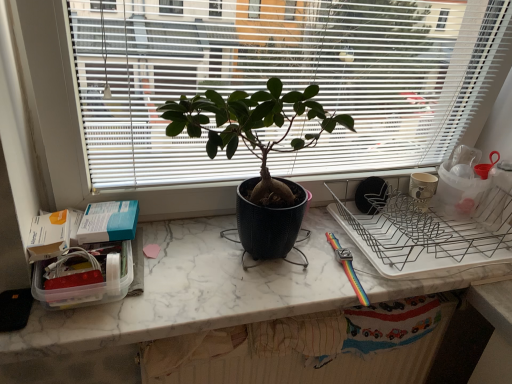
Question: Is matte black plant at center outside matte black pot at center?

Choices:
 (A) yes
 (B) no

Answer: (A)

Question: From a real-world perspective, does matte black plant at center sit lower than matte black pot at center?

Choices:
 (A) no
 (B) yes

Answer: (A)

Question: Can you see matte black plant at center touching matte black pot at center?

Choices:
 (A) no
 (B) yes

Answer: (A)

Question: Can you confirm if matte black plant at center is thinner than matte black pot at center?

Choices:
 (A) no
 (B) yes

Answer: (A)

Question: Can you confirm if matte black plant at center is shorter than matte black pot at center?

Choices:
 (A) no
 (B) yes

Answer: (A)

Question: Considering the positions of matte black pot at center and white marble countertop at center in the image, is matte black pot at center bigger or smaller than white marble countertop at center?

Choices:
 (A) big
 (B) small

Answer: (A)

Question: Do you think matte black pot at center is within white marble countertop at center, or outside of it?

Choices:
 (A) outside
 (B) inside

Answer: (A)

Question: In terms of height, does matte black pot at center look taller or shorter compared to white marble countertop at center?

Choices:
 (A) short
 (B) tall

Answer: (B)

Question: From the image's perspective, is matte black pot at center located above or below white marble countertop at center?

Choices:
 (A) below
 (B) above

Answer: (B)

Question: In terms of height, does white marble countertop at center look taller or shorter compared to matte black plant at center?

Choices:
 (A) tall
 (B) short

Answer: (B)

Question: From the image's perspective, is white marble countertop at center located above or below matte black plant at center?

Choices:
 (A) below
 (B) above

Answer: (A)

Question: Considering the positions of point (205, 324) and point (176, 36), is point (205, 324) closer or farther from the camera than point (176, 36)?

Choices:
 (A) closer
 (B) farther

Answer: (B)

Question: Would you say white marble countertop at center is inside or outside matte black plant at center?

Choices:
 (A) outside
 (B) inside

Answer: (A)

Question: In terms of height, does matte black plant at center look taller or shorter compared to matte black pot at center?

Choices:
 (A) short
 (B) tall

Answer: (B)

Question: From the image's perspective, is matte black plant at center positioned above or below matte black pot at center?

Choices:
 (A) below
 (B) above

Answer: (B)